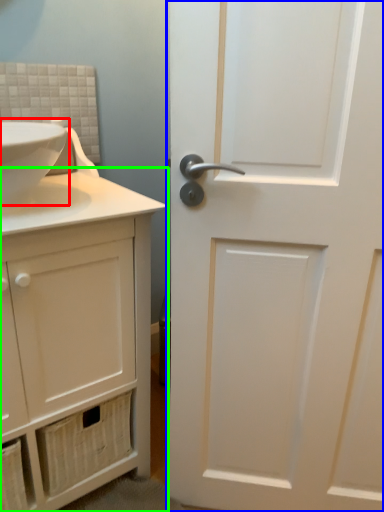
Question: Which is nearer to the sink (highlighted by a red box)? door (highlighted by a blue box) or bathroom cabinet (highlighted by a green box).

Choices:
 (A) door
 (B) bathroom cabinet

Answer: (B)